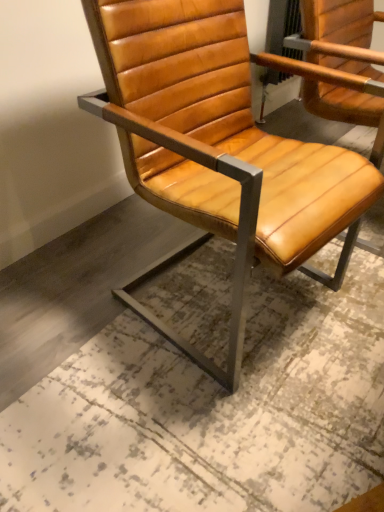
The image size is (384, 512). Describe the element at coordinates (221, 147) in the screenshot. I see `matte leather chair at center` at that location.

Measure the distance between matte leather chair at center and camera.

The distance of matte leather chair at center from camera is 27.13 inches.

This screenshot has width=384, height=512. I want to click on matte leather chair at center, so click(x=221, y=147).

This screenshot has width=384, height=512. Identify the location of matte leather chair at center. (221, 147).